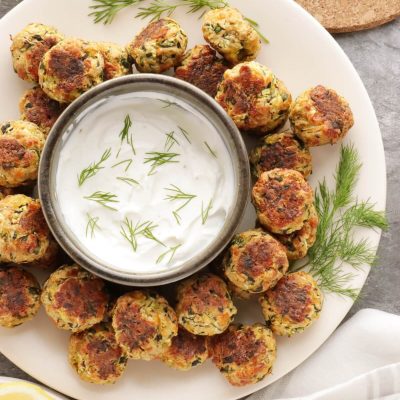
At what (x,y) coordinates should I click in order to perform the action: click on table. Please return your answer as a coordinate pair (x, y). This screenshot has height=400, width=400. Looking at the image, I should click on (385, 281), (379, 40), (5, 6), (9, 367).